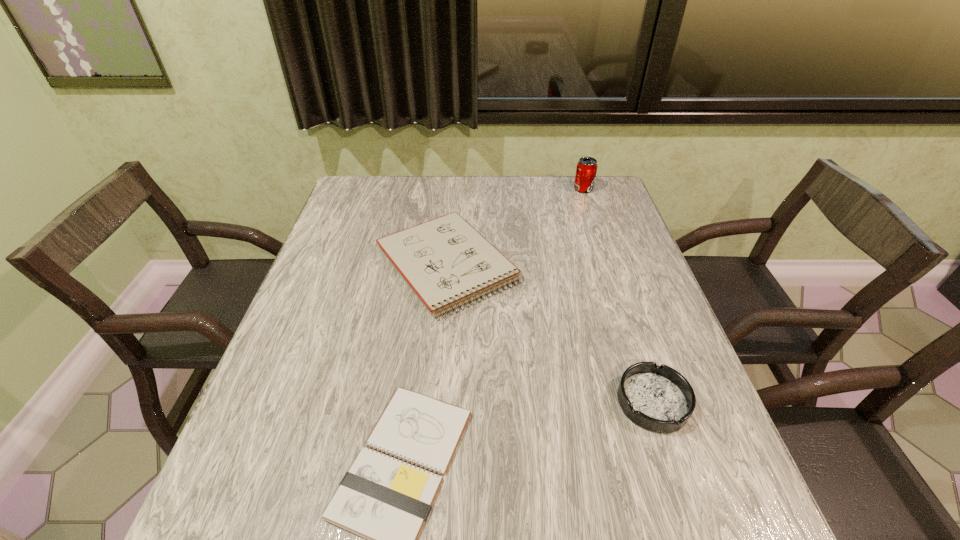
Identify the location of soda can. The image size is (960, 540). (586, 170).

You are a GUI agent. You are given a task and a screenshot of the screen. Output one action in this format:
    pyautogui.click(x=<x>, y=<y>)
    Task: Click on the tallest object
    Image resolution: width=960 pixels, height=540 pixels.
    Given the screenshot: What is the action you would take?
    pyautogui.click(x=586, y=170)

The width and height of the screenshot is (960, 540). What are the coordinates of `the taller notepad` in the screenshot? It's located at (446, 262).

What are the coordinates of `the second farthest object` in the screenshot? It's located at click(446, 262).

You are a GUI agent. You are given a task and a screenshot of the screen. Output one action in this format:
    pyautogui.click(x=<x>, y=<y>)
    Task: Click on the ashtray
    The width and height of the screenshot is (960, 540).
    Given the screenshot: What is the action you would take?
    pyautogui.click(x=659, y=399)

I want to click on free point located on the front of the farthest object, so click(588, 204).

Identify the location of vacant space situated 0.090m on the back of the taller notepad. (452, 203).

What are the coordinates of `blank space located on the left of the ashtray` in the screenshot? It's located at 483,402.

Find the location of a particular element. This screenshot has height=540, width=960. object that is at the far edge is located at coordinates point(586,170).

Locate an element on the screen. The height and width of the screenshot is (540, 960). object that is at the left edge is located at coordinates coord(446,262).